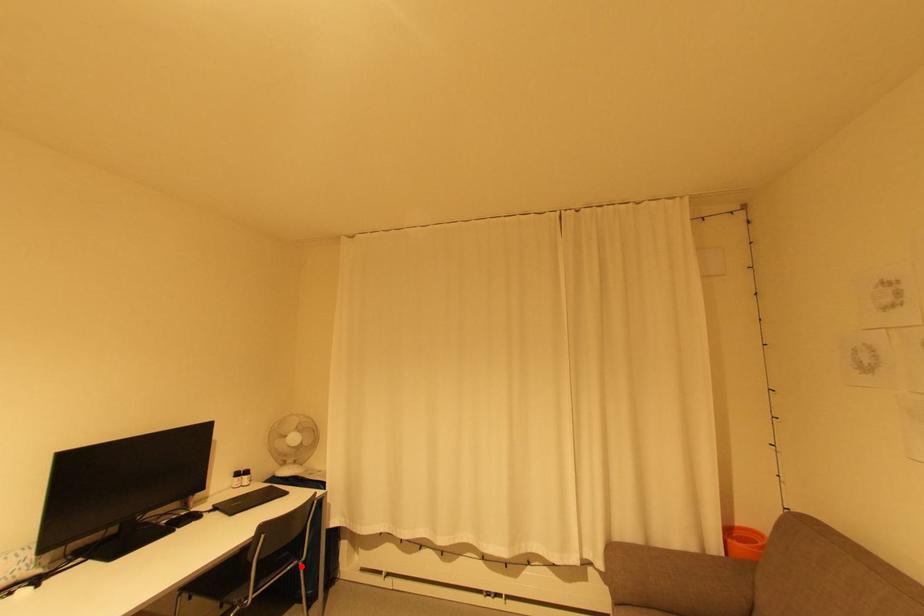
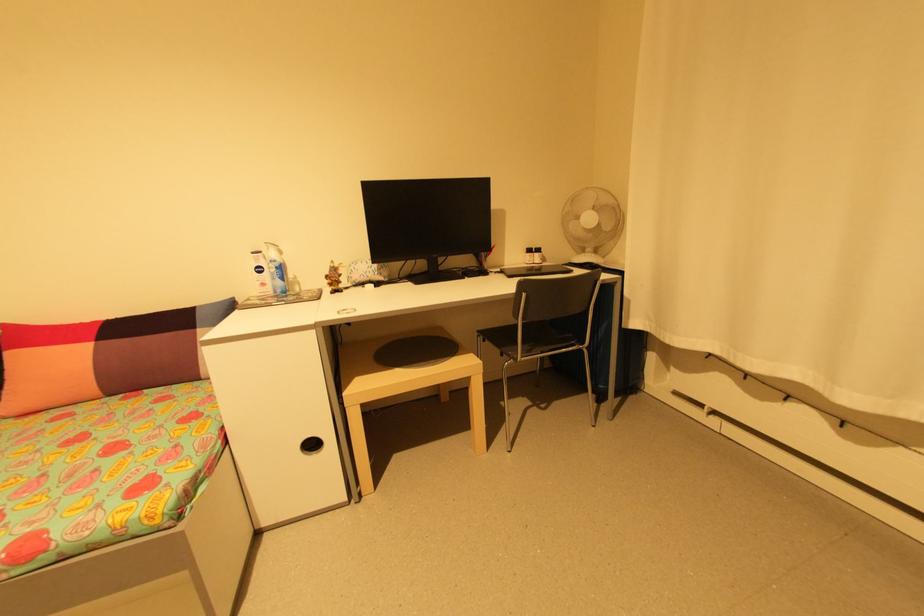
Find the pixel in the second image that matches the highlighted location in the first image.

(585, 352)